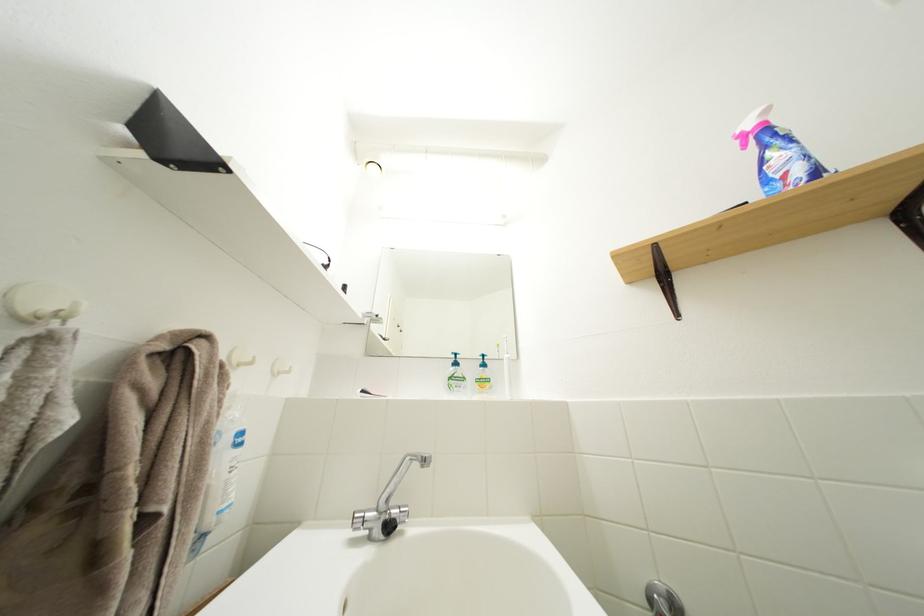
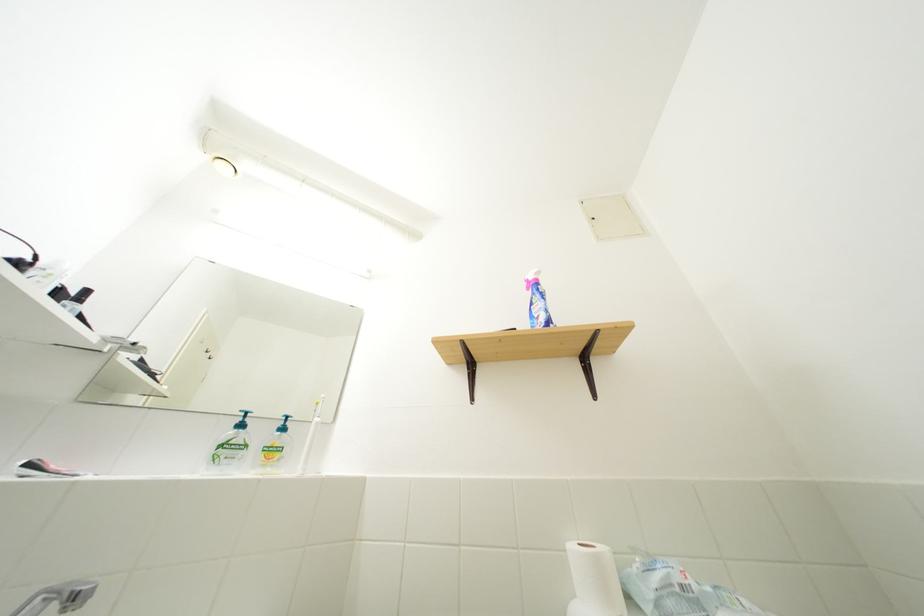
Question: Based on the continuous images, in which direction is the camera rotating? Reply with the corresponding letter.

Choices:
 (A) Left
 (B) Right
 (C) Up
 (D) Down

Answer: (B)